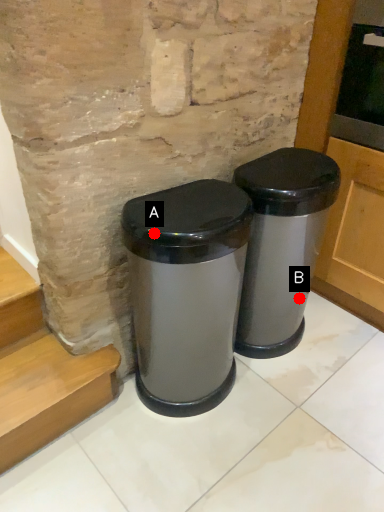
Question: Two points are circled on the image, labeled by A and B beside each circle. Among these points, which one is farthest from the camera?

Choices:
 (A) A is further
 (B) B is further

Answer: (B)